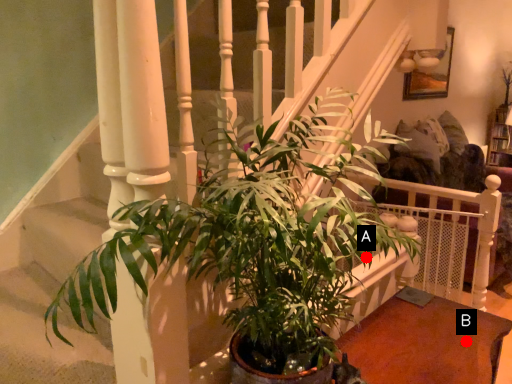
Question: Two points are circled on the image, labeled by A and B beside each circle. Which point is closer to the camera taking this photo?

Choices:
 (A) A is closer
 (B) B is closer

Answer: (A)